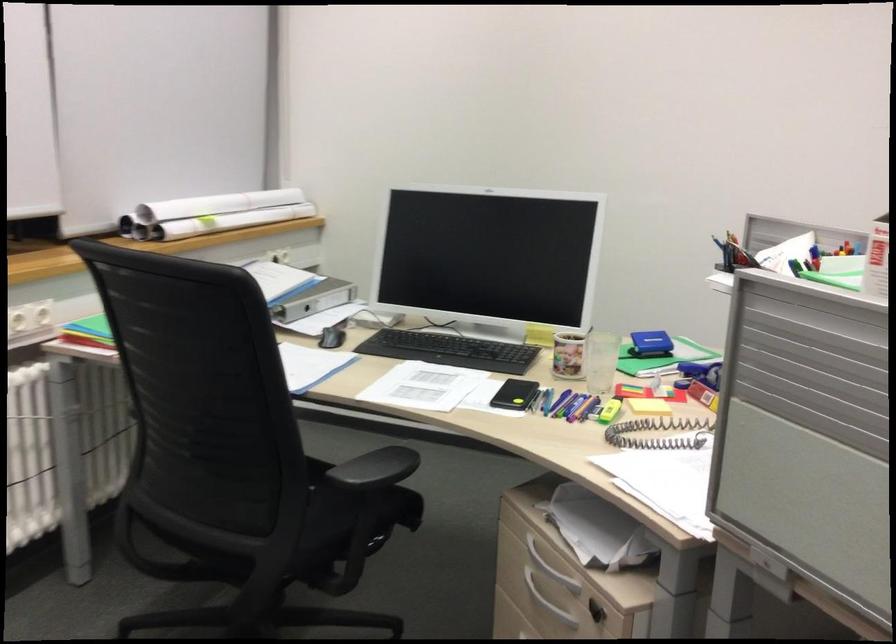
This screenshot has height=644, width=896. I want to click on chair sitting surface, so click(x=380, y=498).